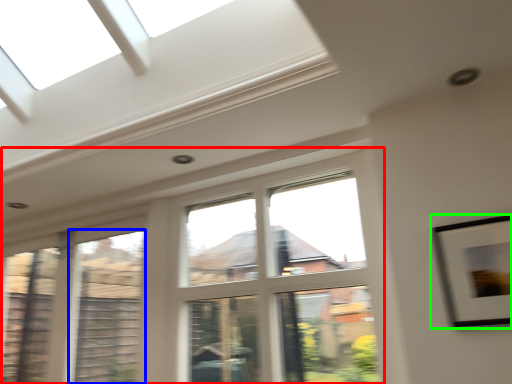
Question: Estimate the real-world distances between objects in this image. Which object is farther from window (highlighted by a red box), window (highlighted by a blue box) or picture frame (highlighted by a green box)?

Choices:
 (A) window
 (B) picture frame

Answer: (B)